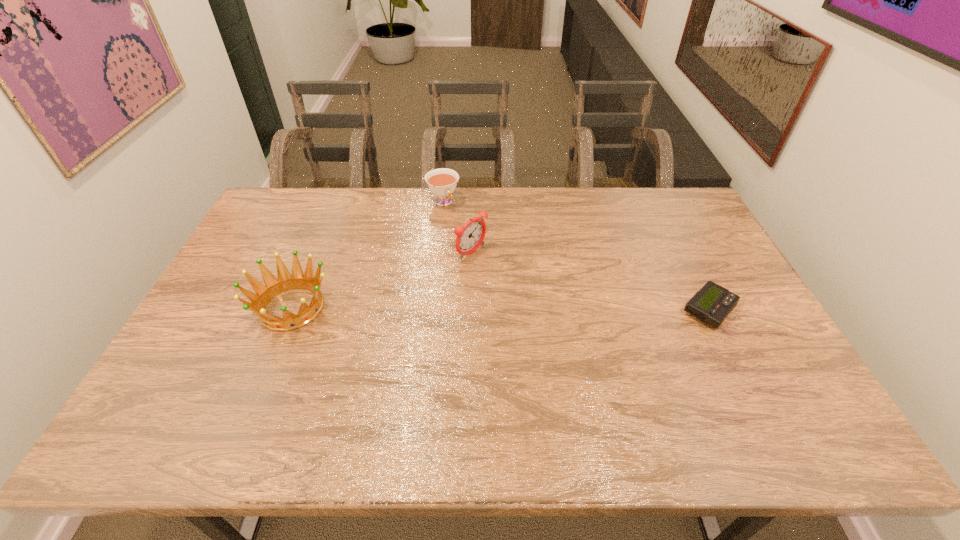
This screenshot has height=540, width=960. What are the coordinates of `vacant space on the desktop that is between the crown and the rightmost object and is positioned on the front-facing side of the second farthest object` in the screenshot? It's located at (561, 309).

Where is `free space on the desktop that is between the leftmost object and the shortest object and is positioned on the side of the teacup with the handle`? Image resolution: width=960 pixels, height=540 pixels. free space on the desktop that is between the leftmost object and the shortest object and is positioned on the side of the teacup with the handle is located at coordinates (512, 309).